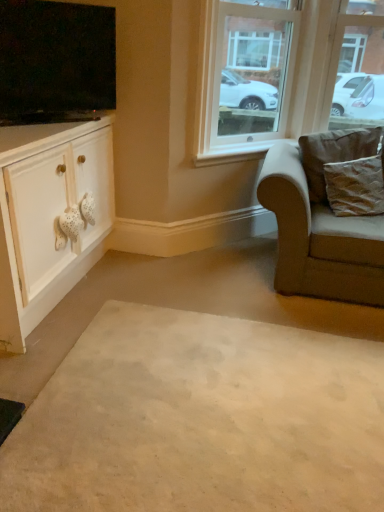
Question: Based on their sizes in the image, would you say beige carpet at center is bigger or smaller than beige fabric chair at right?

Choices:
 (A) big
 (B) small

Answer: (B)

Question: Does point (112, 394) appear closer or farther from the camera than point (304, 243)?

Choices:
 (A) closer
 (B) farther

Answer: (A)

Question: Which is nearer to the white matte cabinet at left?

Choices:
 (A) beige carpet at center
 (B) flat screen tv at upper left
 (C) brown textured pillow at right, the second pillow positioned from the bottom
 (D) clear glass window at upper center
 (E) beige fabric chair at right

Answer: (B)

Question: Estimate the real-world distances between objects in this image. Which object is farther from the brown textured pillow at right, the second pillow positioned from the bottom?

Choices:
 (A) beige fabric chair at right
 (B) flat screen tv at upper left
 (C) brown textured pillow at right, the first pillow ordered from the bottom
 (D) beige carpet at center
 (E) clear glass window at upper center

Answer: (B)